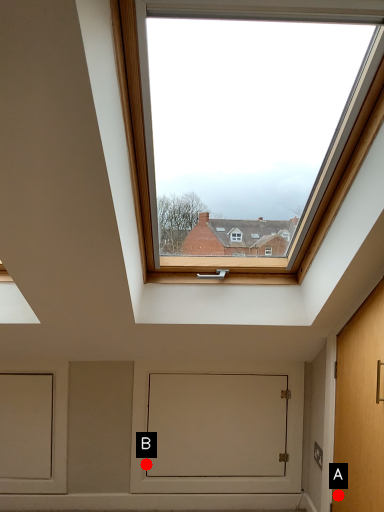
Question: Two points are circled on the image, labeled by A and B beside each circle. Which point appears farthest from the camera in this image?

Choices:
 (A) A is further
 (B) B is further

Answer: (B)